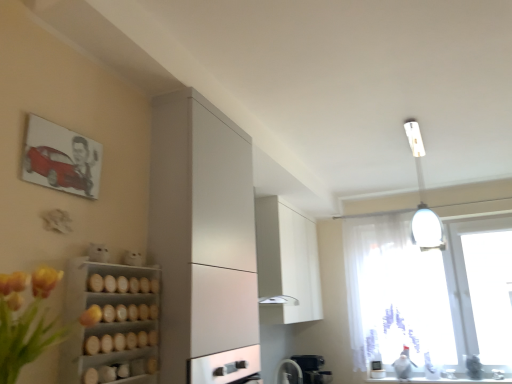
You are a GUI agent. You are given a task and a screenshot of the screen. Output one action in this format:
    pyautogui.click(x=<x>, y=<y>)
    Task: Click on the free space above white glossy light fixture at upper right (from a real-world perspective)
    Image resolution: width=512 pixels, height=384 pixels.
    Given the screenshot: What is the action you would take?
    pyautogui.click(x=421, y=137)